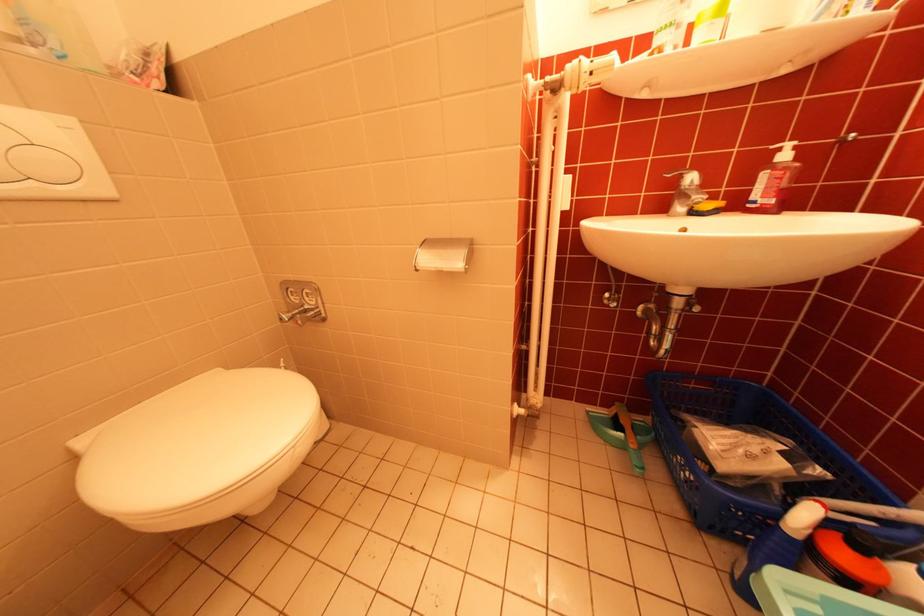
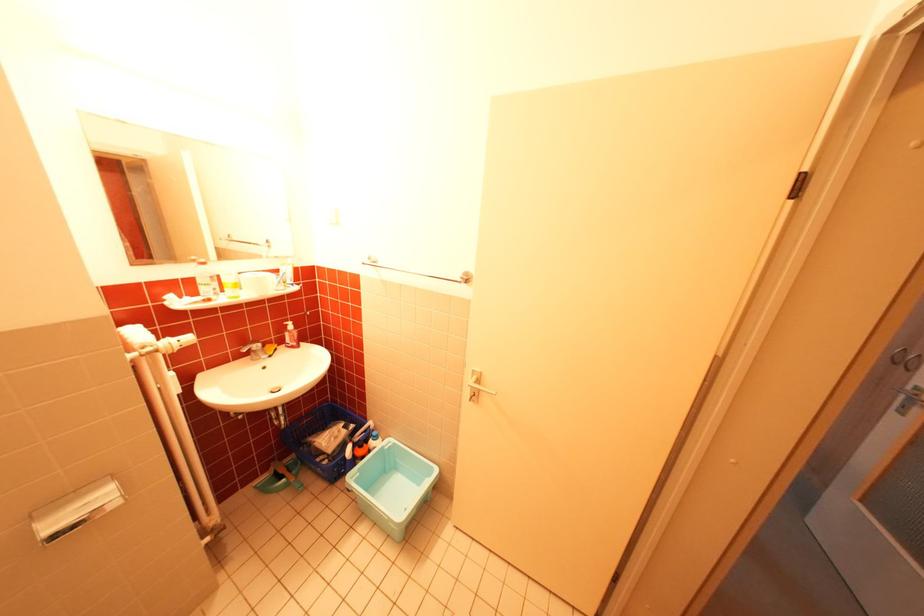
In the second image, find the point that corresponds to (674,354) in the first image.

(295, 428)